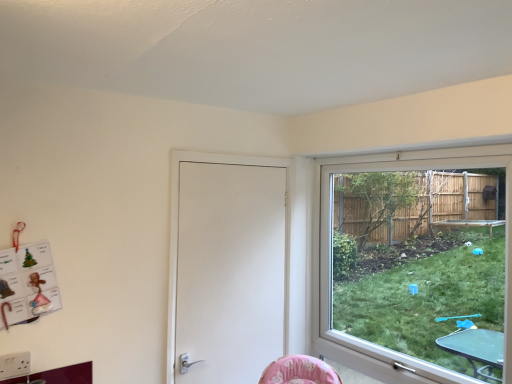
Question: From a real-world perspective, is white matte door at center on top of clear glass window at right?

Choices:
 (A) no
 (B) yes

Answer: (A)

Question: Does white matte door at center turn towards clear glass window at right?

Choices:
 (A) no
 (B) yes

Answer: (A)

Question: Is white matte door at center turned away from clear glass window at right?

Choices:
 (A) no
 (B) yes

Answer: (A)

Question: Is white matte door at center closer to camera compared to clear glass window at right?

Choices:
 (A) no
 (B) yes

Answer: (A)

Question: Does white matte door at center have a lesser height compared to clear glass window at right?

Choices:
 (A) no
 (B) yes

Answer: (B)

Question: Can you confirm if white matte door at center is positioned to the left of clear glass window at right?

Choices:
 (A) no
 (B) yes

Answer: (B)

Question: Is clear glass window at right positioned far away from white matte door at center?

Choices:
 (A) no
 (B) yes

Answer: (A)

Question: Is clear glass window at right oriented away from white matte door at center?

Choices:
 (A) no
 (B) yes

Answer: (A)

Question: Considering the relative positions of clear glass window at right and white matte door at center in the image provided, is clear glass window at right behind white matte door at center?

Choices:
 (A) yes
 (B) no

Answer: (B)

Question: Can we say clear glass window at right lies outside white matte door at center?

Choices:
 (A) no
 (B) yes

Answer: (B)

Question: Considering the relative sizes of clear glass window at right and white matte door at center in the image provided, is clear glass window at right shorter than white matte door at center?

Choices:
 (A) no
 (B) yes

Answer: (A)

Question: Does clear glass window at right have a smaller size compared to white matte door at center?

Choices:
 (A) no
 (B) yes

Answer: (A)

Question: From the image's perspective, is clear glass window at right above or below white matte door at center?

Choices:
 (A) below
 (B) above

Answer: (B)